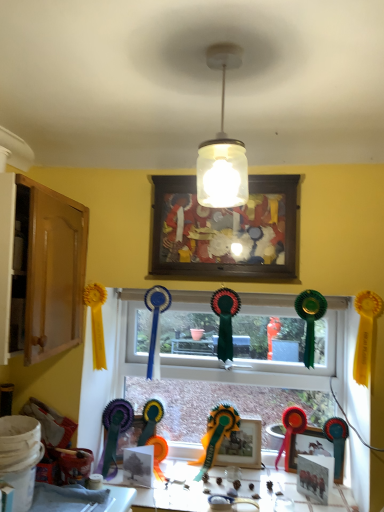
Where is `free space to the left of matte plastic picture frame at lower right, positioned as the second picture frame in bottom-to-top order`? free space to the left of matte plastic picture frame at lower right, positioned as the second picture frame in bottom-to-top order is located at coordinates (277, 482).